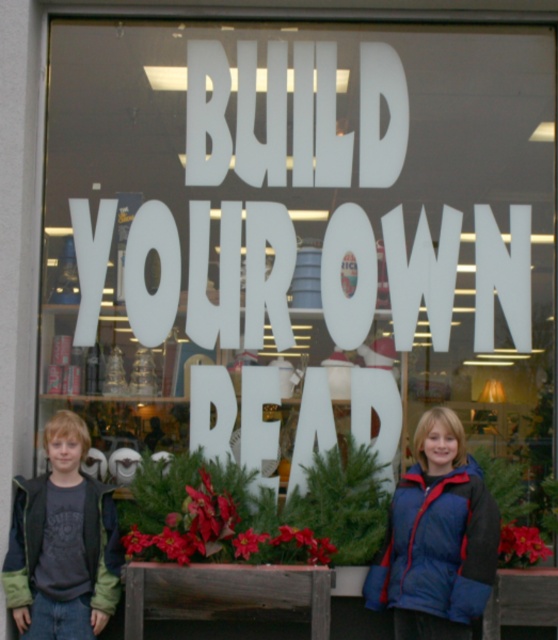
From the picture: You are a store employee who needs to hang a sign that is 1.2 meters tall between the blue down jacket at lower right and the green fleece jacket at lower left. Can the space between them accommodate the sign vertically?

The blue down jacket at lower right is taller than the green fleece jacket at lower left. Since the sign is 1.2 meters tall, you should measure the vertical space between them to ensure it can fit. However, without knowing the exact height difference, it is uncertain if the space is sufficient.

You are a photographer standing in front of the store window. You want to take a picture of both the point at coordinates point (x=411, y=499) and point (x=41, y=602). Which point is closer to your camera lens?

Point (x=41, y=602) is closer to the camera lens because it is nearer than point (x=411, y=499), which is further away.